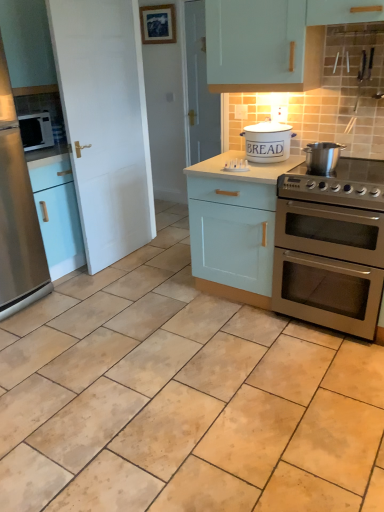
Question: Considering the positions of satin silver microwave at left and satin silver oven at right in the image, is satin silver microwave at left bigger or smaller than satin silver oven at right?

Choices:
 (A) big
 (B) small

Answer: (B)

Question: From the image's perspective, is satin silver microwave at left above or below satin silver oven at right?

Choices:
 (A) below
 (B) above

Answer: (B)

Question: Which is nearer to the stainless steel gas stove at right?

Choices:
 (A) light blue wood cabinet at center
 (B) stainless steel refrigerator at left
 (C) stainless steel pot at upper right, the second appliance viewed from the back
 (D) white ceramic bread bin at center, the 1th appliance from the back
 (E) satin silver microwave at left

Answer: (C)

Question: Considering the real-world distances, which object is closest to the white ceramic bread bin at center, the 1th appliance from the back?

Choices:
 (A) satin silver microwave at left
 (B) stainless steel gas stove at right
 (C) stainless steel pot at upper right, the second appliance viewed from the back
 (D) satin silver oven at right
 (E) light blue wood cabinet at center

Answer: (C)